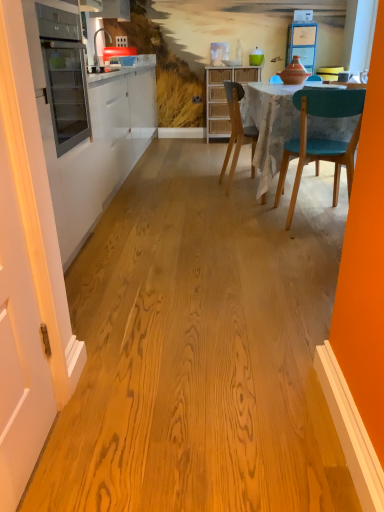
Question: Is white painted wood door at left taller than teal glossy vase at upper center?

Choices:
 (A) yes
 (B) no

Answer: (A)

Question: Does white painted wood door at left have a lesser width compared to teal glossy vase at upper center?

Choices:
 (A) yes
 (B) no

Answer: (A)

Question: Considering the relative sizes of white painted wood door at left and teal glossy vase at upper center in the image provided, is white painted wood door at left smaller than teal glossy vase at upper center?

Choices:
 (A) yes
 (B) no

Answer: (B)

Question: Is white painted wood door at left closer to camera compared to teal glossy vase at upper center?

Choices:
 (A) no
 (B) yes

Answer: (B)

Question: From the image's perspective, would you say white painted wood door at left is shown under teal glossy vase at upper center?

Choices:
 (A) yes
 (B) no

Answer: (A)

Question: Is white painted wood door at left wider than teal glossy vase at upper center?

Choices:
 (A) no
 (B) yes

Answer: (A)

Question: Is teal glossy vase at upper center located outside woven wood cabinet at center?

Choices:
 (A) yes
 (B) no

Answer: (A)

Question: Is teal glossy vase at upper center closer to the viewer compared to woven wood cabinet at center?

Choices:
 (A) no
 (B) yes

Answer: (A)

Question: Can you confirm if teal glossy vase at upper center is shorter than woven wood cabinet at center?

Choices:
 (A) yes
 (B) no

Answer: (A)

Question: Does teal glossy vase at upper center turn towards woven wood cabinet at center?

Choices:
 (A) yes
 (B) no

Answer: (B)

Question: From a real-world perspective, is teal glossy vase at upper center on woven wood cabinet at center?

Choices:
 (A) yes
 (B) no

Answer: (A)

Question: Does teal glossy vase at upper center have a larger size compared to woven wood cabinet at center?

Choices:
 (A) no
 (B) yes

Answer: (A)

Question: Can you confirm if teal glossy vase at upper center is taller than matte glass oven at left?

Choices:
 (A) no
 (B) yes

Answer: (A)